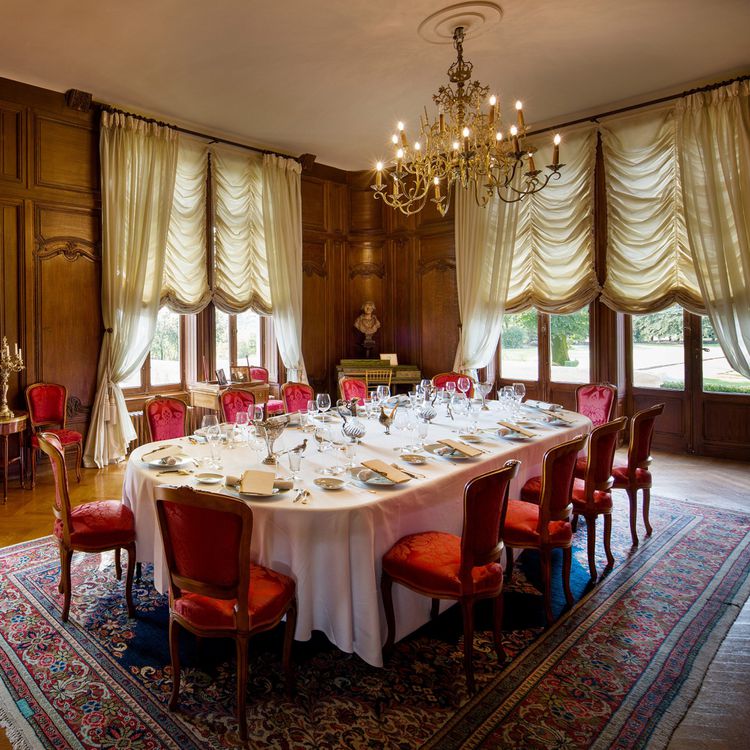
What are the coordinates of `bowl` in the screenshot? It's located at [x=328, y=482].